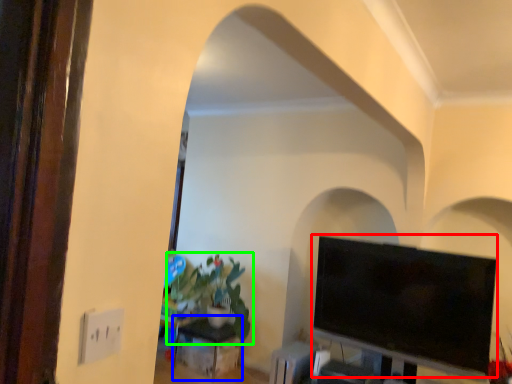
Question: Which object is positioned closest to television (highlighted by a red box)? Select from table (highlighted by a blue box) and houseplant (highlighted by a green box).

Choices:
 (A) table
 (B) houseplant

Answer: (B)